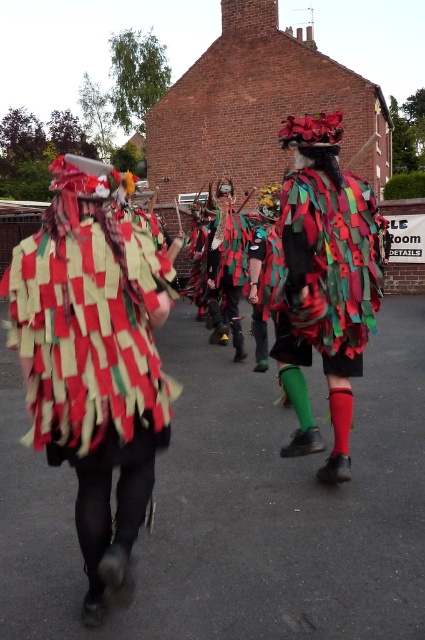
Question: Does textured fabric cape at center appear on the right side of textured fabric mask at center?

Choices:
 (A) no
 (B) yes

Answer: (B)

Question: Considering the relative positions of textured fabric costume at center and textured fabric cape at center in the image provided, where is textured fabric costume at center located with respect to textured fabric cape at center?

Choices:
 (A) above
 (B) below

Answer: (B)

Question: Is textured fabric costume at center bigger than textured fabric mask at center?

Choices:
 (A) yes
 (B) no

Answer: (B)

Question: Which point is closer to the camera?

Choices:
 (A) textured felt costume at center
 (B) textured fabric cape at center
 (C) textured fabric costume at center

Answer: (C)

Question: Considering the real-world distances, which object is closest to the textured fabric cape at center?

Choices:
 (A) textured fabric mask at center
 (B) textured fabric costume at center

Answer: (B)

Question: Which object is closer to the camera taking this photo?

Choices:
 (A) textured fabric cape at center
 (B) textured fabric costume at center

Answer: (B)